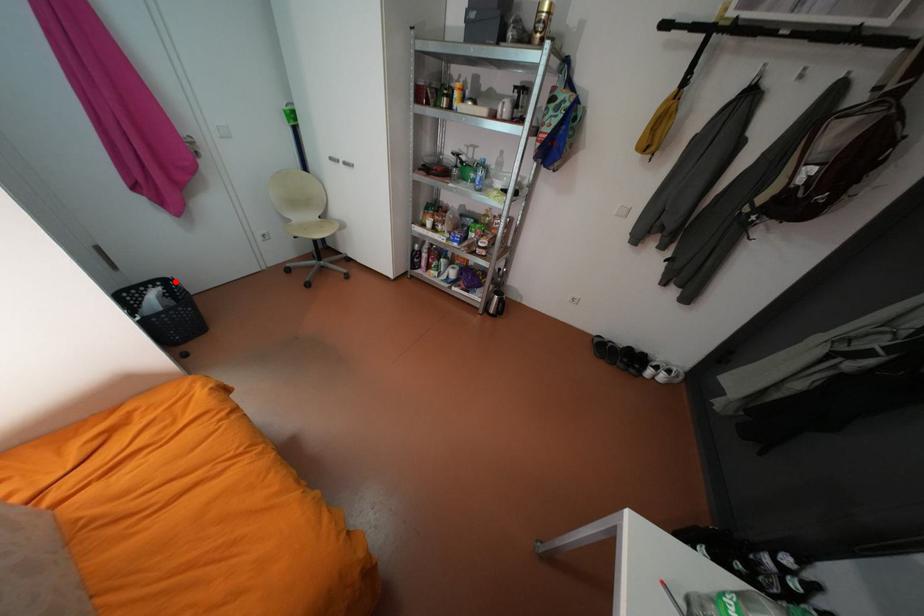
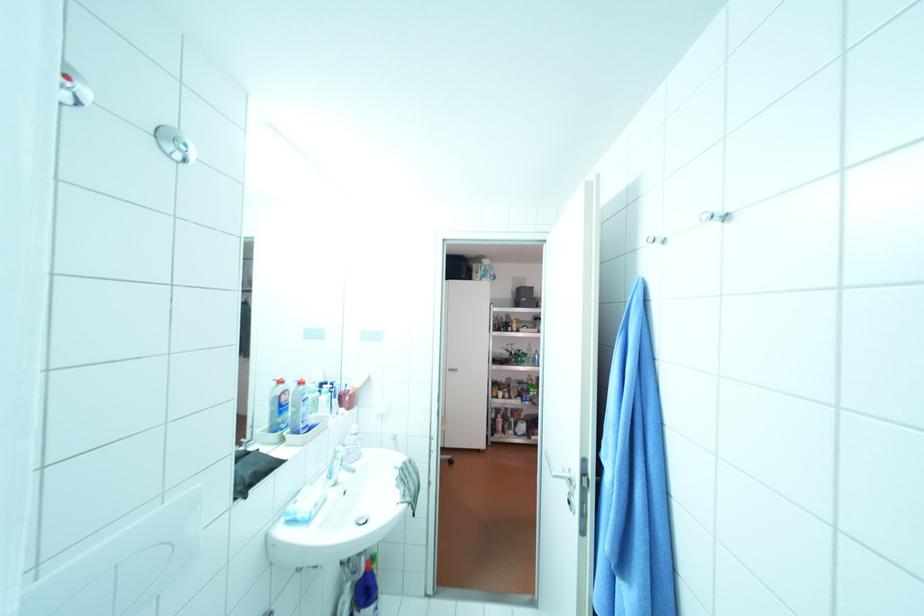
Question: I am providing you with two images of the same scene from different viewpoints. A red point is marked on the first image. Can you still see the location of the red point in image 2?

Choices:
 (A) Yes
 (B) No

Answer: (B)